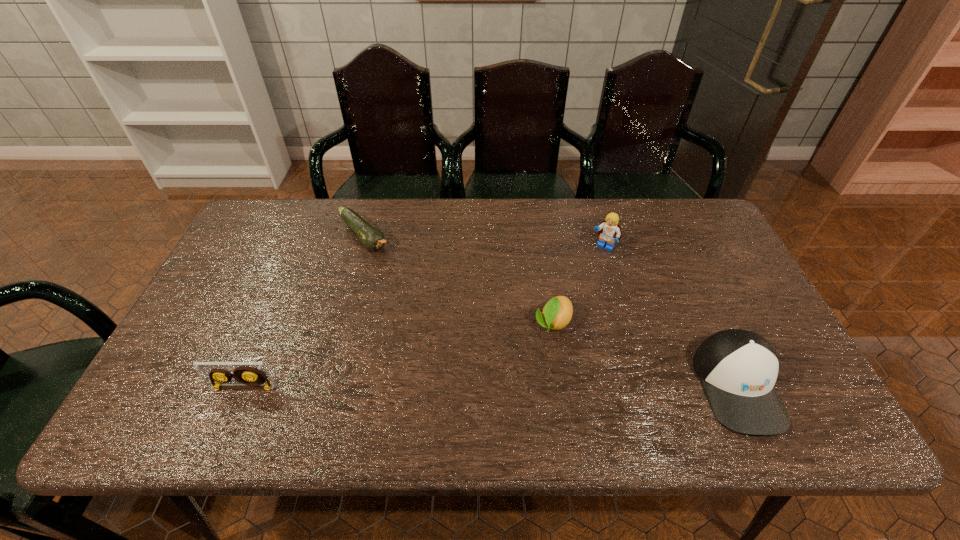
Locate an element on the screen. blank region between the rightmost object and the Lego is located at coordinates (670, 316).

What are the coordinates of `vacant space that's between the second shortest object and the videotape` in the screenshot? It's located at (398, 355).

At what (x,y) coordinates should I click in order to perform the action: click on free point between the cap and the lemon. Please return your answer as a coordinate pair (x, y). This screenshot has height=540, width=960. Looking at the image, I should click on (645, 355).

Find the location of a particular element. free point between the zucchini and the second shortest object is located at coordinates (459, 280).

The image size is (960, 540). Identify the location of free space between the Lego and the cap. (670, 316).

Find the location of a particular element. Image resolution: width=960 pixels, height=540 pixels. vacant area between the second object from right to left and the videotape is located at coordinates (423, 317).

I want to click on unoccupied position between the fourth tallest object and the zucchini, so click(x=459, y=280).

Find the location of a particular element. The height and width of the screenshot is (540, 960). unoccupied area between the Lego and the fourth object from right to left is located at coordinates (484, 241).

I want to click on free spot between the fourth object from left to right and the third object from left to right, so click(578, 285).

Identify which object is the third closest to the lemon. Please provide its 2D coordinates. Your answer should be formatted as a tuple, i.e. [(x, y)], where the tuple contains the x and y coordinates of a point satisfying the conditions above.

[(372, 238)]